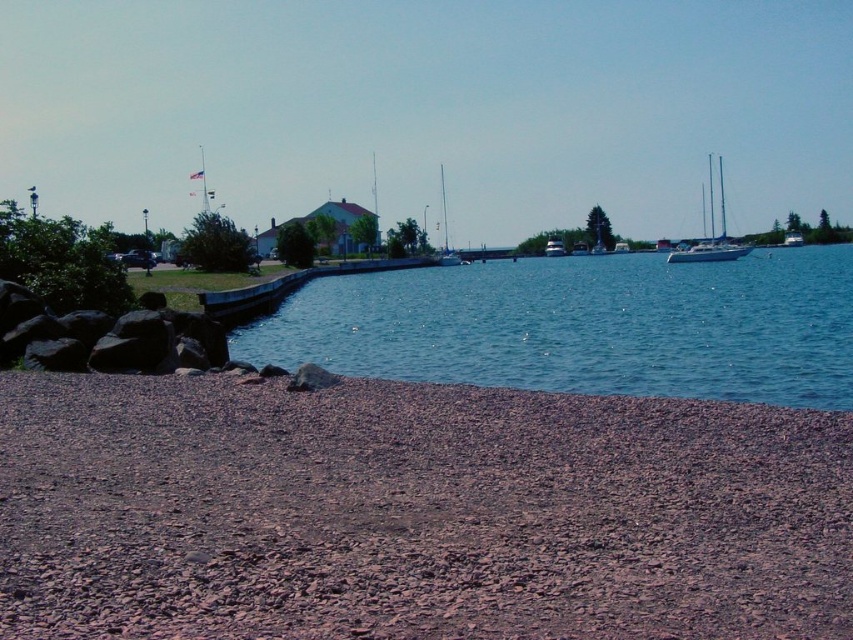
You are standing on the rocky shoreline and want to reach the green plastic boat at center. The blue water at center is between you and the boat. If you can swim 100 feet per minute, how many minutes will it take you to reach the boat?

The distance between blue water at center and green plastic boat at center is 259.28 feet. Swimming at 100 feet per minute, it would take approximately 2.59 minutes to reach the boat.

You are standing at the edge of the brown gravel beach at lower left and want to walk to the blue water at center. Considering the width of the beach and the water, which path would require taking more steps?

The blue water at center is wider than the brown gravel beach at lower left, so walking to the blue water at center would require taking more steps since it spans a greater distance.